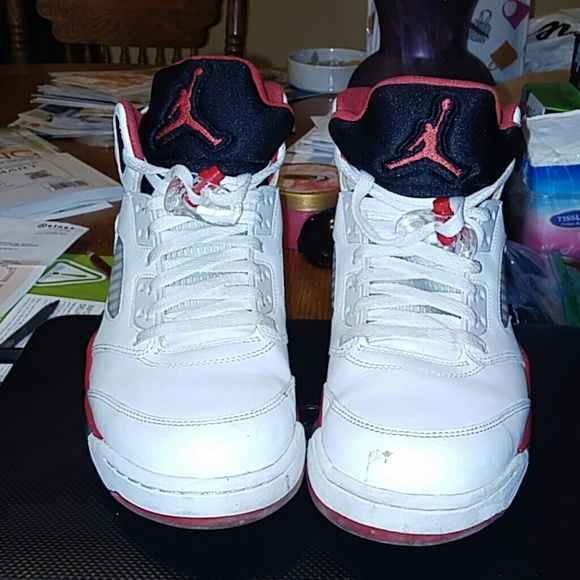
Locate an element on the screen. Image resolution: width=580 pixels, height=580 pixels. table is located at coordinates (310, 289), (96, 155), (96, 238).